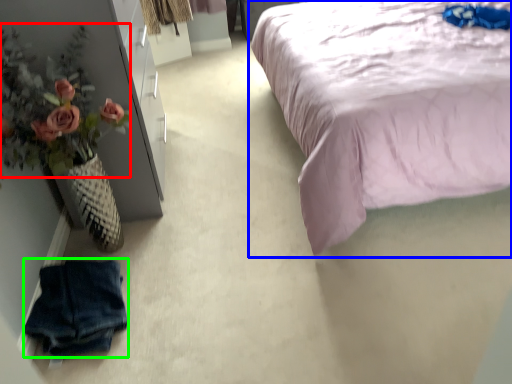
Question: Estimate the real-world distances between objects in this image. Which object is farther from floral arrangement (highlighted by a red box), bed (highlighted by a blue box) or clothing (highlighted by a green box)?

Choices:
 (A) bed
 (B) clothing

Answer: (A)